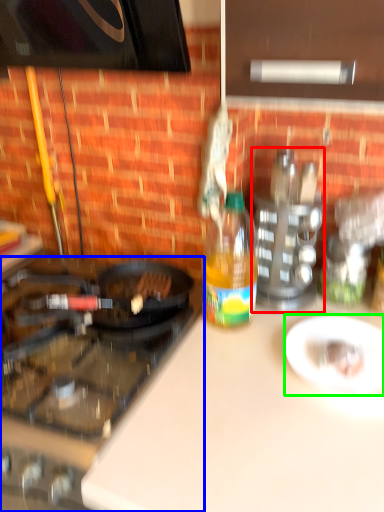
Question: Estimate the real-world distances between objects in this image. Which object is farther from appliance (highlighted by a red box), gas stove (highlighted by a blue box) or plate (highlighted by a green box)?

Choices:
 (A) gas stove
 (B) plate

Answer: (A)